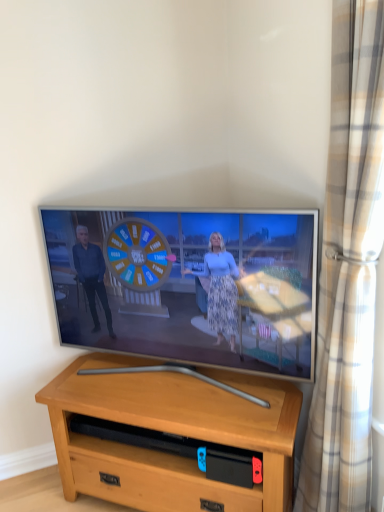
Locate an element on the screen. blank space above light brown wood desk at center (from a real-world perspective) is located at coordinates (181, 387).